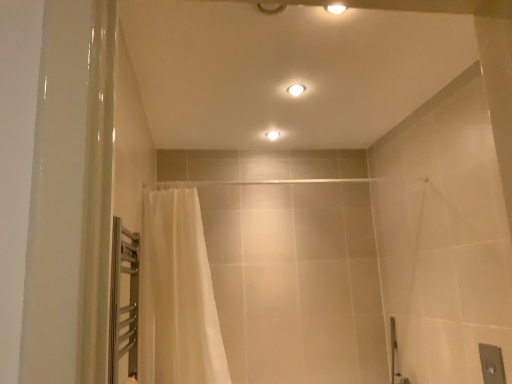
Question: From the image's perspective, is white sheer curtain at left positioned above or below matte white ceiling light at center, which is the 2th light fixture from top to bottom?

Choices:
 (A) above
 (B) below

Answer: (B)

Question: Is white sheer curtain at left to the left or to the right of matte white ceiling light at center, which is the 2th light fixture from top to bottom, in the image?

Choices:
 (A) right
 (B) left

Answer: (B)

Question: Which is farther from the white glossy light fixture at upper center, the 2th light fixture from the back?

Choices:
 (A) white sheer curtain at left
 (B) matte white ceiling light at center, the 1th light fixture viewed from the back

Answer: (A)

Question: Which is farther from the white sheer curtain at left?

Choices:
 (A) white glossy light fixture at upper center, which is the 1th light fixture from top to bottom
 (B) matte white ceiling light at center, arranged as the first light fixture when viewed from the left

Answer: (B)